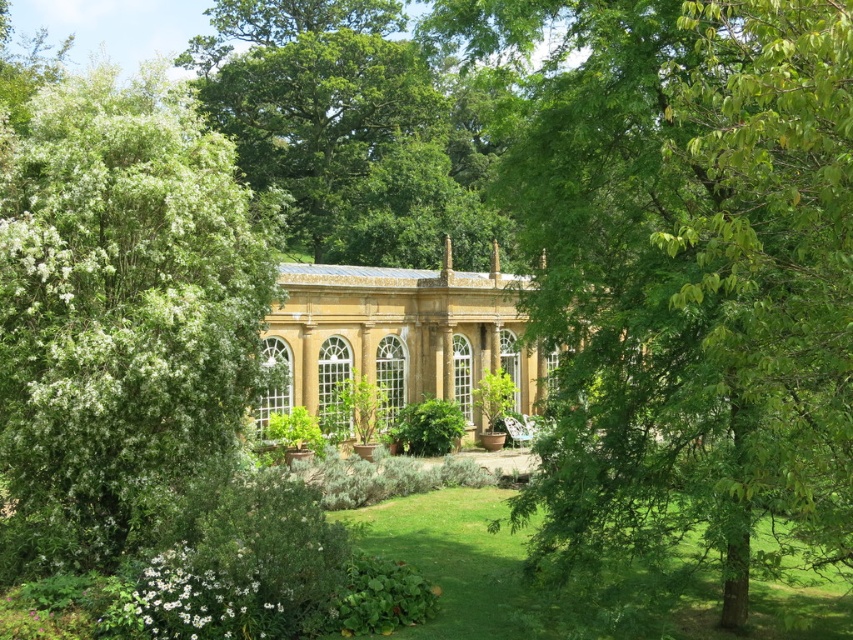
Question: Which object is positioned farthest from the golden stone palace at center?

Choices:
 (A) green leafy tree at center
 (B) green leafy tree at left

Answer: (A)

Question: Is green leafy tree at left bigger than golden stone palace at center?

Choices:
 (A) yes
 (B) no

Answer: (A)

Question: Which object is positioned farthest from the green leafy tree at center?

Choices:
 (A) green leafy tree at left
 (B) golden stone palace at center

Answer: (B)

Question: Does green leafy tree at center appear on the right side of golden stone palace at center?

Choices:
 (A) no
 (B) yes

Answer: (B)

Question: Does green leafy tree at center appear on the right side of green leafy tree at left?

Choices:
 (A) no
 (B) yes

Answer: (B)

Question: Which point appears closest to the camera in this image?

Choices:
 (A) (747, 268)
 (B) (540, 401)
 (C) (258, 218)

Answer: (A)